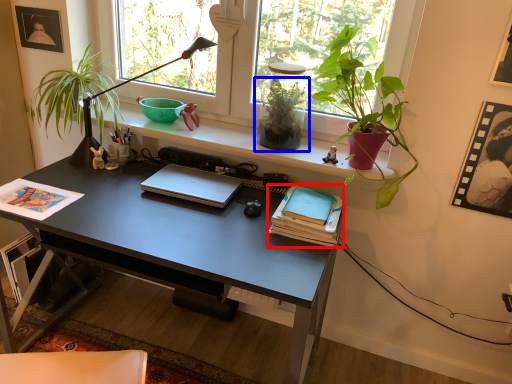
Question: Among these objects, which one is nearest to the camera, paperback book (highlighted by a red box) or houseplant (highlighted by a blue box)?

Choices:
 (A) paperback book
 (B) houseplant

Answer: (A)